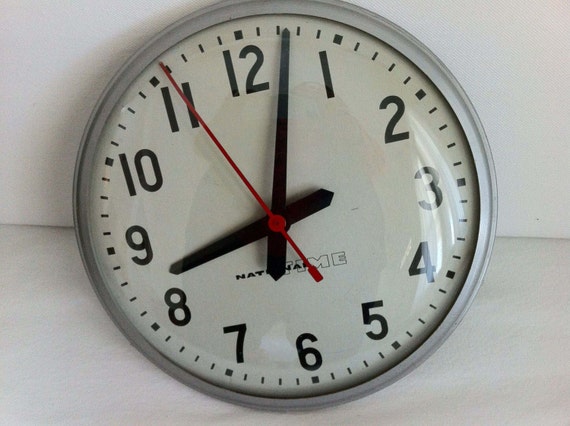
Where is `wall`? wall is located at coordinates (557, 124).